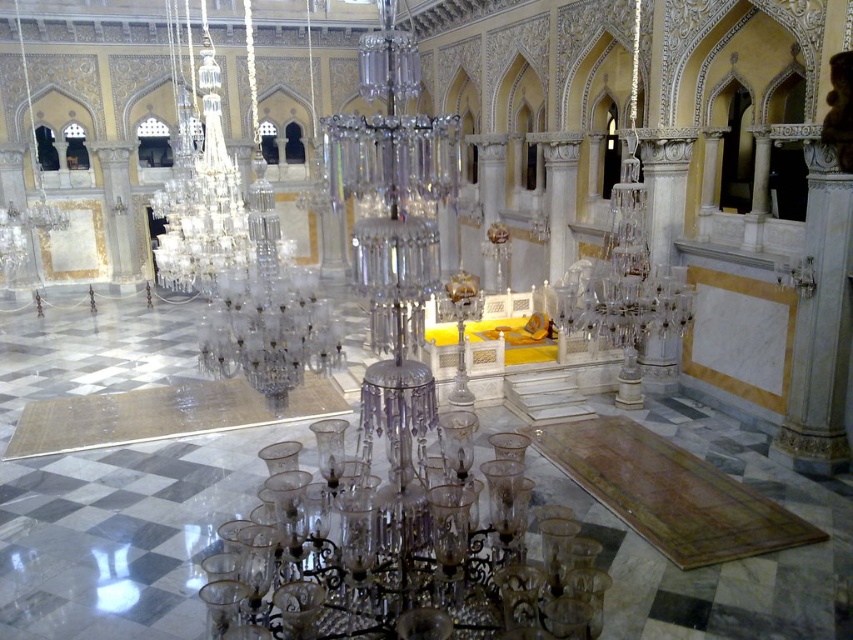
In the scene shown: Is clear glass candle holder at center further to the viewer compared to clear crystal chandelier at upper center?

No, clear glass candle holder at center is in front of clear crystal chandelier at upper center.

How far apart are clear glass candle holder at center and clear crystal chandelier at upper center?

clear glass candle holder at center is 6.48 meters from clear crystal chandelier at upper center.

I want to click on clear glass candle holder at center, so click(401, 540).

Can you confirm if clear crystal chandelier at upper center is wider than white marble column at center-right?

Indeed, clear crystal chandelier at upper center has a greater width compared to white marble column at center-right.

Is clear crystal chandelier at upper center to the right of white marble column at center-right from the viewer's perspective?

In fact, clear crystal chandelier at upper center is to the left of white marble column at center-right.

Which is behind, point (178, 168) or point (657, 372)?

Positioned behind is point (178, 168).

At what (x,y) coordinates should I click in order to perform the action: click on clear crystal chandelier at upper center. Please return your answer as a coordinate pair (x, y). Looking at the image, I should click on (200, 193).

Can you confirm if clear glass candle holder at center is taller than white marble column at center-right?

Indeed, clear glass candle holder at center has a greater height compared to white marble column at center-right.

Does clear glass candle holder at center have a greater width compared to white marble column at center-right?

Correct, the width of clear glass candle holder at center exceeds that of white marble column at center-right.

Who is more distant from viewer, (x=523, y=508) or (x=641, y=161)?

The point (x=641, y=161) is more distant.

Where is `clear glass candle holder at center`? Image resolution: width=853 pixels, height=640 pixels. clear glass candle holder at center is located at coordinates (401, 540).